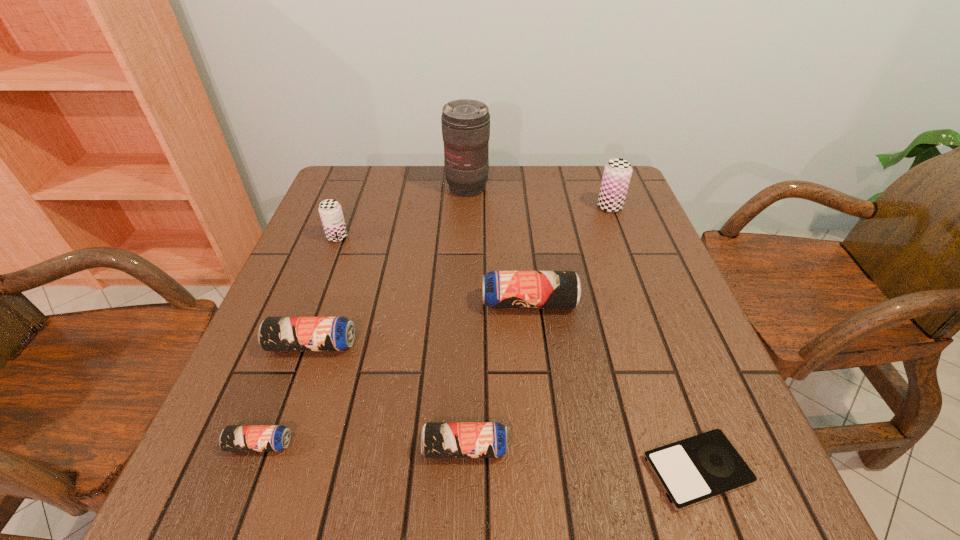
Identify the location of free spot between the second tallest object and the third tallest beer can. This screenshot has height=540, width=960. (569, 255).

Find the location of a particular element. The height and width of the screenshot is (540, 960). vacant area that lies between the second shortest object and the farthest beer can is located at coordinates (435, 326).

Find the location of a particular element. The image size is (960, 540). vacant area that lies between the fourth tallest object and the fifth tallest beer can is located at coordinates (497, 375).

Identify the location of vacant area that lies between the fourth farthest object and the iPod. The image size is (960, 540). (613, 386).

Where is `free space between the gray iPod and the third tallest beer can`? The image size is (960, 540). free space between the gray iPod and the third tallest beer can is located at coordinates (613, 386).

Where is `free spot between the seventh shortest object and the tallest object`? free spot between the seventh shortest object and the tallest object is located at coordinates (539, 198).

Identify the location of free space between the fifth nearest beer can and the second biggest blue beer can. This screenshot has width=960, height=540. (324, 291).

I want to click on vacant region between the telephoto lens and the third farthest object, so click(402, 212).

Find the location of a particular element. Image resolution: width=960 pixels, height=540 pixels. object that is the second closest to the rightmost beer can is located at coordinates (501, 289).

Locate an element on the screen. This screenshot has height=540, width=960. object that is the fourth closest to the third farthest beer can is located at coordinates (617, 173).